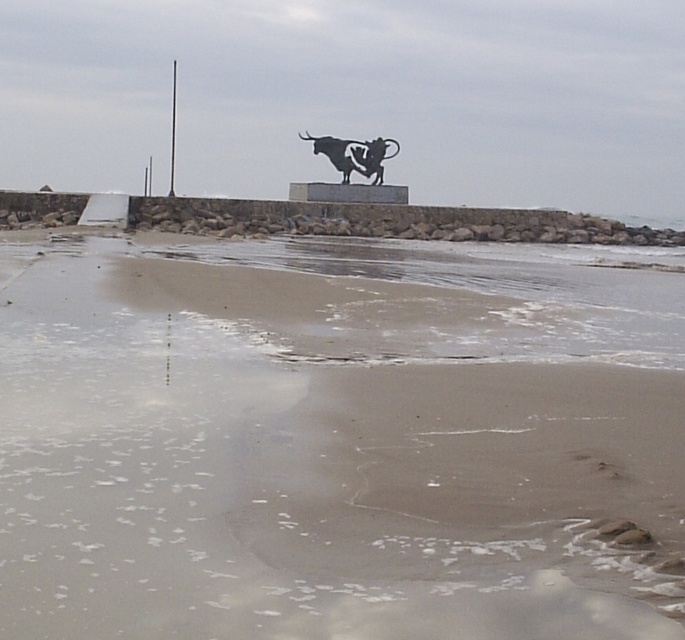
You are a photographer wanting to capture the black metal bull at upper center and the sandy at center in your shot. Based on their positions, which object should you frame first to ensure both are in the same view?

The black metal bull at upper center should be framed first since the sandy at center is to its right, so adjusting the frame to include both from the bull side would work.

You are an artist planning to create a miniature model of the coastal scene. You have a limited amount of metal material. Given the black metal bull at upper center and the smooth metal pole at upper center, which object should you prioritize making first to conserve material?

The black metal bull at upper center has a smaller width than the smooth metal pole at upper center, so you should prioritize making the black metal bull at upper center first to conserve material.